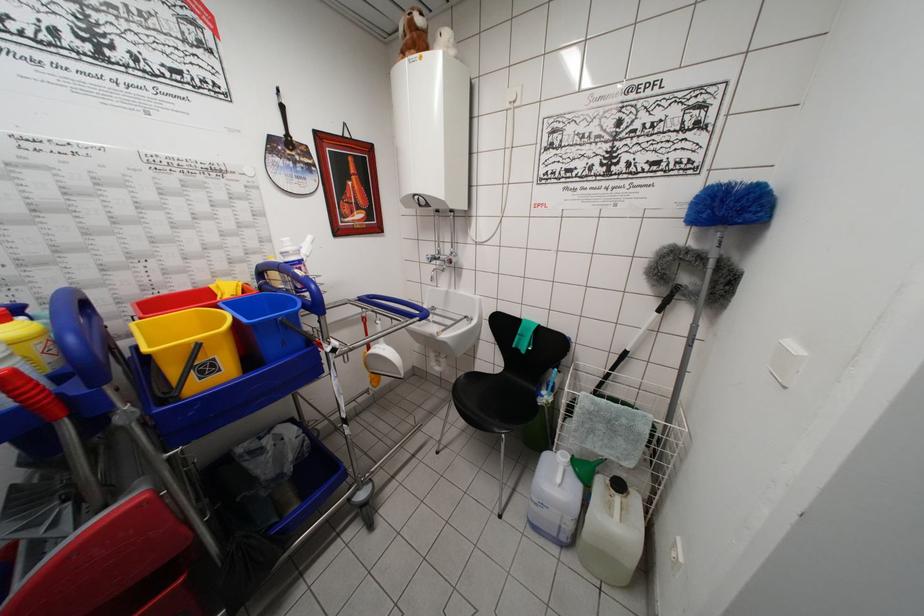
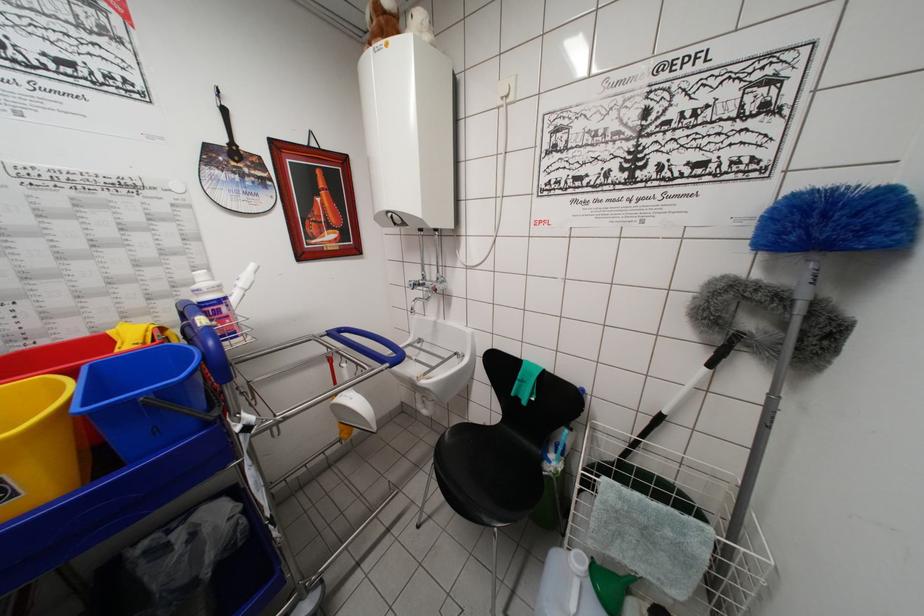
Which direction would the cameraman need to move to produce the second image?

The movement direction of the cameraman is right, forward.